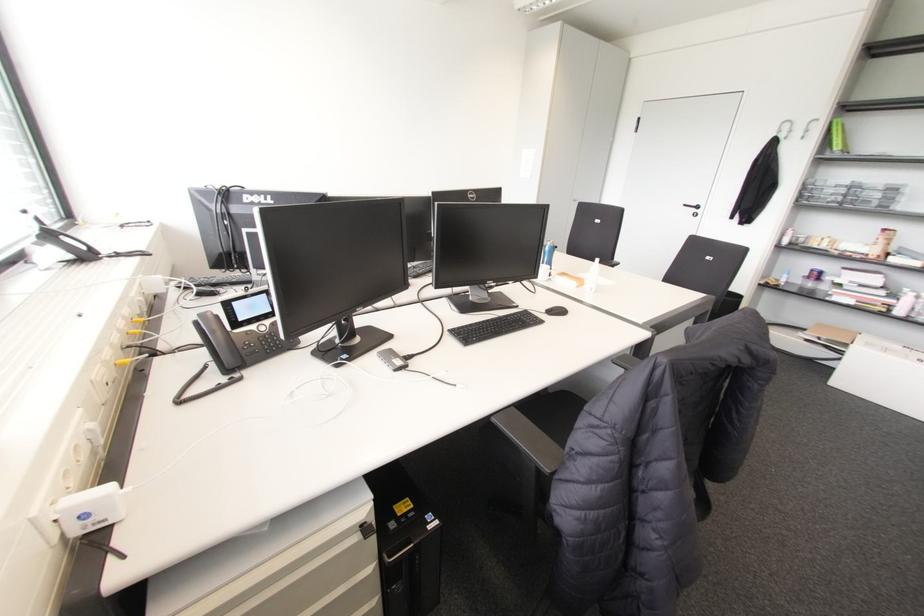
Where is `black telephone handset`? The image size is (924, 616). black telephone handset is located at coordinates (220, 339).